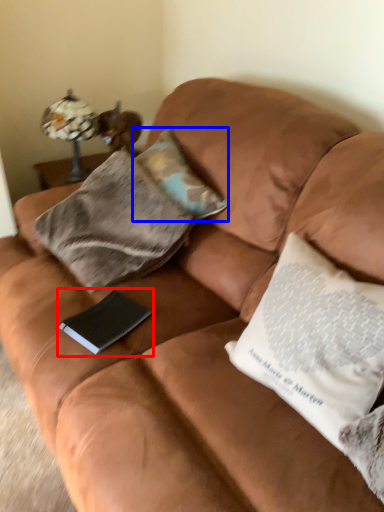
Question: Which object appears closest to the camera in this image, paperback book (highlighted by a red box) or pillow (highlighted by a blue box)?

Choices:
 (A) paperback book
 (B) pillow

Answer: (A)